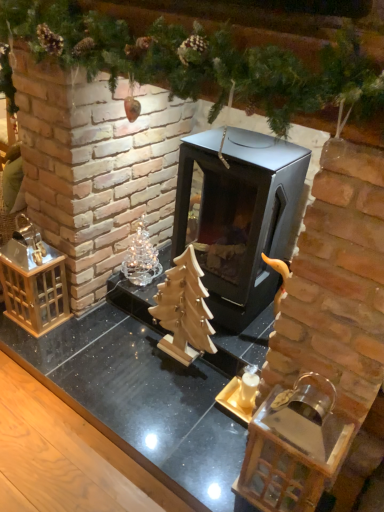
Locate an element on the screen. vacant space underneath wooden christmas tree at center (from a real-world perspective) is located at coordinates click(x=175, y=357).